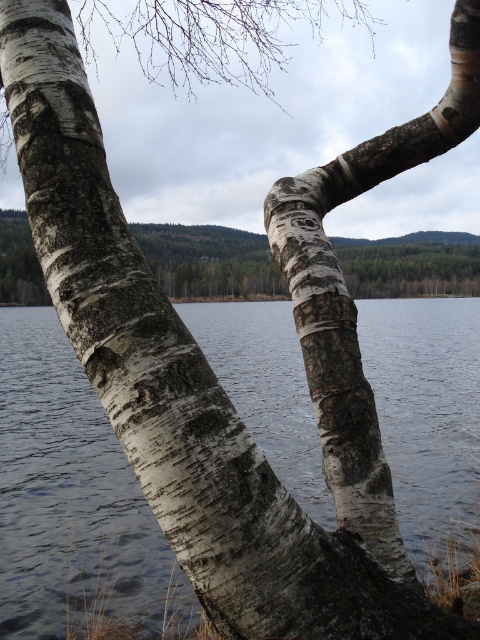
The height and width of the screenshot is (640, 480). What are the coordinates of `white bark tree trunk at center` in the screenshot? It's located at (351, 300).

Is point (305, 246) positioned before point (189, 257)?

Yes, point (305, 246) is closer to viewer.

Does point (357, 371) lie behind point (16, 211)?

No, it is not.

This screenshot has width=480, height=640. What are the coordinates of `white bark tree trunk at center` in the screenshot? It's located at (351, 300).